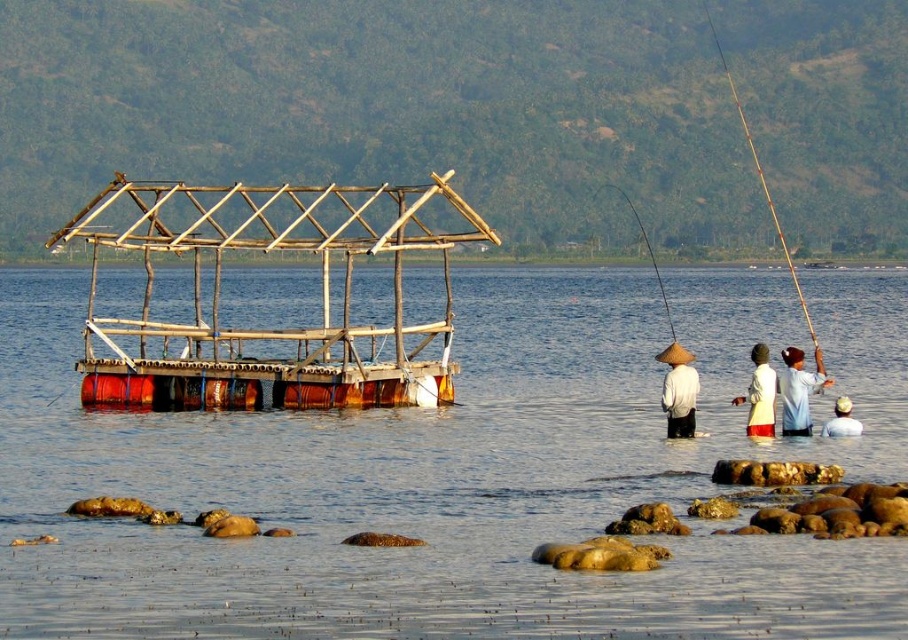
Question: Which of the following is the closest to the observer?

Choices:
 (A) (662, 291)
 (B) (751, 349)
 (C) (682, 426)

Answer: (C)

Question: Can you confirm if natural wood raft at center is positioned to the left of wooden fishing pole at right?

Choices:
 (A) yes
 (B) no

Answer: (A)

Question: Considering the relative positions of matte straw hat at center and yellow fishing rod at center in the image provided, where is matte straw hat at center located with respect to yellow fishing rod at center?

Choices:
 (A) right
 (B) left

Answer: (B)

Question: Which point appears farthest from the camera in this image?

Choices:
 (A) (775, 221)
 (B) (646, 244)
 (C) (707, 428)

Answer: (A)

Question: Which of the following is the closest to the observer?

Choices:
 (A) transparent wooden structure at center
 (B) matte straw hat at center
 (C) white cotton hat at lower right
 (D) white woven hat at center

Answer: (A)

Question: Considering the relative positions of natural wood raft at center and white woven hat at right in the image provided, where is natural wood raft at center located with respect to white woven hat at right?

Choices:
 (A) below
 (B) above

Answer: (B)